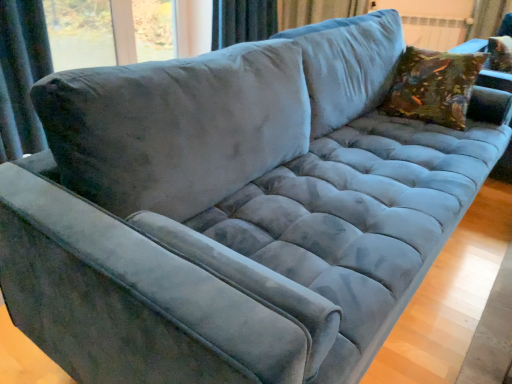
The width and height of the screenshot is (512, 384). In order to click on textured gold-green pillow at upper right in this screenshot , I will do `click(433, 86)`.

Describe the element at coordinates (433, 86) in the screenshot. I see `textured gold-green pillow at upper right` at that location.

This screenshot has width=512, height=384. I want to click on textured gold-green pillow at upper right, so click(433, 86).